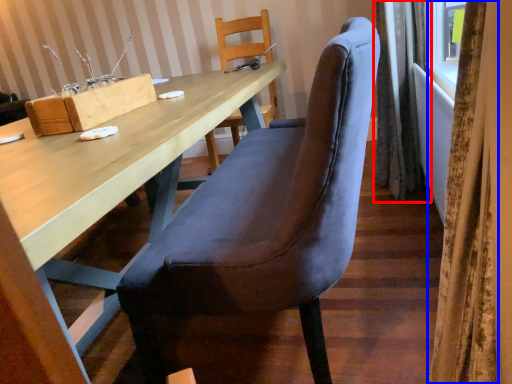
Question: Which of the following is the farthest to the observer, curtain (highlighted by a red box) or curtain (highlighted by a blue box)?

Choices:
 (A) curtain
 (B) curtain

Answer: (A)